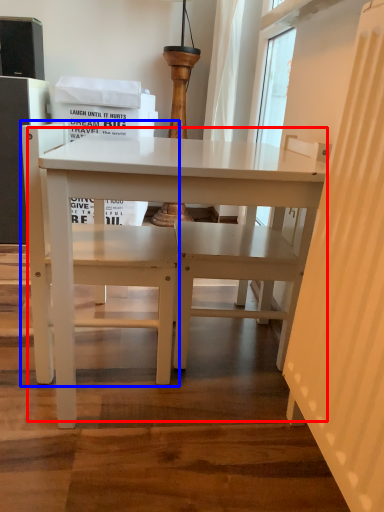
Question: Which object appears farthest to the camera in this image, table (highlighted by a red box) or chair (highlighted by a blue box)?

Choices:
 (A) table
 (B) chair

Answer: (B)